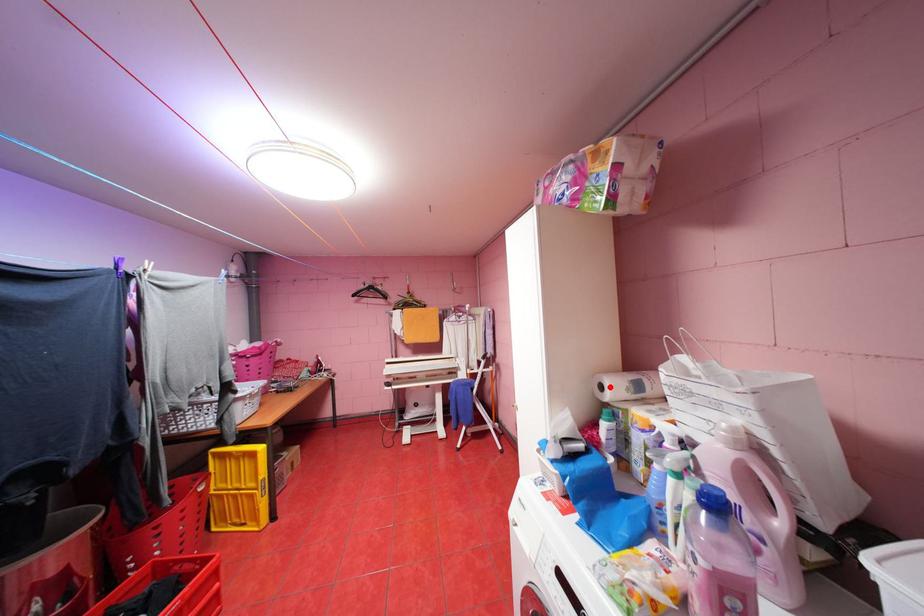
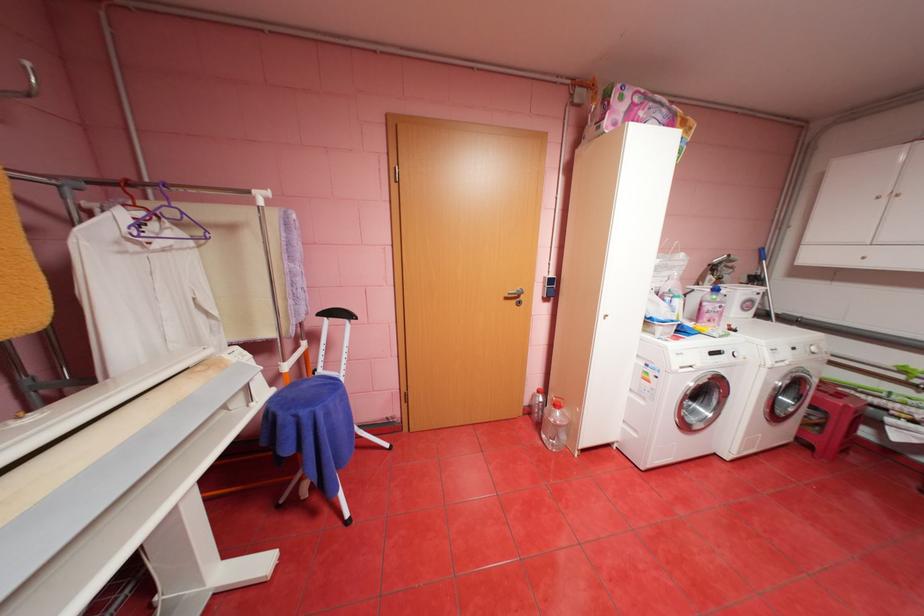
Question: I am providing you with two images of the same scene from different viewpoints. A red point is marked on the first image. Can you still see the location of the red point in image 2?

Choices:
 (A) Yes
 (B) No

Answer: (B)